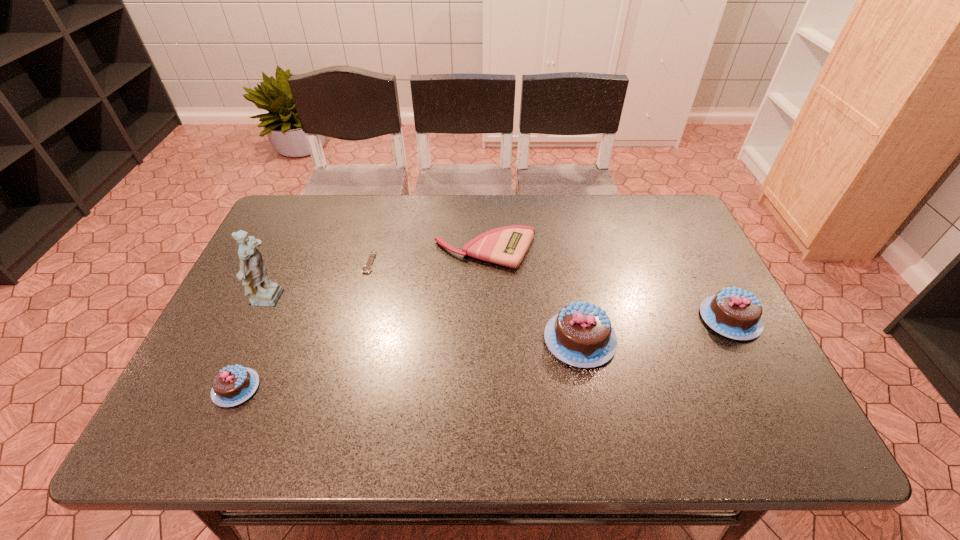
This screenshot has width=960, height=540. Identify the location of the third shortest object. (231, 386).

You are a GUI agent. You are given a task and a screenshot of the screen. Output one action in this format:
    pyautogui.click(x=<x>, y=<y>)
    Task: Click on the leftmost chocolate cake
    This screenshot has width=960, height=540.
    Given the screenshot: What is the action you would take?
    pyautogui.click(x=231, y=386)

This screenshot has width=960, height=540. Identify the location of the second chocolate cake from right to left. (581, 335).

Identify the location of the second tallest chocolate cake. (734, 313).

Locate an element on the screen. The image size is (960, 540). the rightmost object is located at coordinates pos(734,313).

Locate an element on the screen. This screenshot has width=960, height=540. the fifth tallest object is located at coordinates (507, 246).

At what (x,y) coordinates should I click in order to perform the action: click on the tallest object. Please return your answer as a coordinate pair (x, y). This screenshot has width=960, height=540. Looking at the image, I should click on (262, 292).

This screenshot has width=960, height=540. Identify the location of the third object from left to right. (367, 268).

Identify the location of watch. The height and width of the screenshot is (540, 960). (367, 268).

You are a GUI agent. You are given a task and a screenshot of the screen. Output one action in this format:
    pyautogui.click(x=<x>, y=<y>)
    Task: Click on the vacant space situated on the right of the fourth tallest object
    
    Given the screenshot: What is the action you would take?
    pyautogui.click(x=326, y=388)